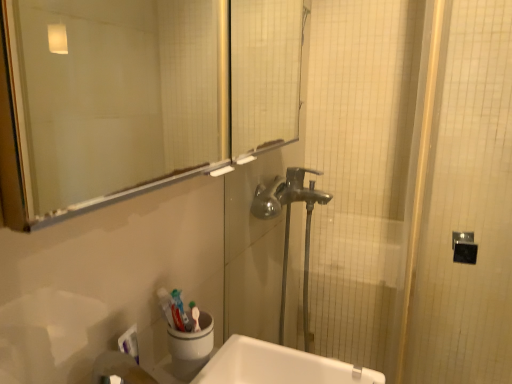
Question: Is point (298, 354) closer or farther from the camera than point (116, 153)?

Choices:
 (A) closer
 (B) farther

Answer: (A)

Question: In terms of height, does white glossy sink at lower center look taller or shorter compared to transparent glass mirror at upper center?

Choices:
 (A) short
 (B) tall

Answer: (A)

Question: Considering the real-world distances, which object is farthest from the transparent glass mirror at upper center?

Choices:
 (A) white glossy sink at lower center
 (B) polished chrome faucet at center

Answer: (A)

Question: Based on their relative distances, which object is nearer to the transparent glass mirror at upper center?

Choices:
 (A) white glossy sink at lower center
 (B) polished chrome faucet at center

Answer: (B)